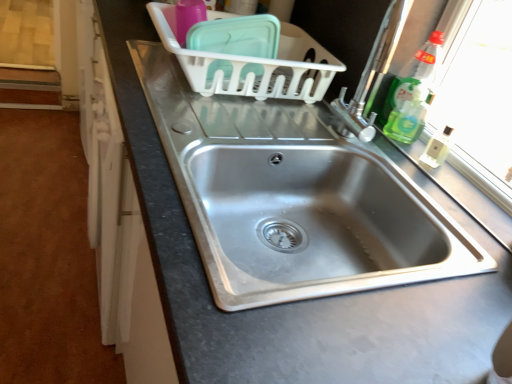
You are a GUI agent. You are given a task and a screenshot of the screen. Output one action in this format:
    pyautogui.click(x=<x>, y=<y>)
    Task: Click on the unoccupied region to the right of satin nickel faucet at right
    
    Given the screenshot: What is the action you would take?
    pyautogui.click(x=395, y=170)